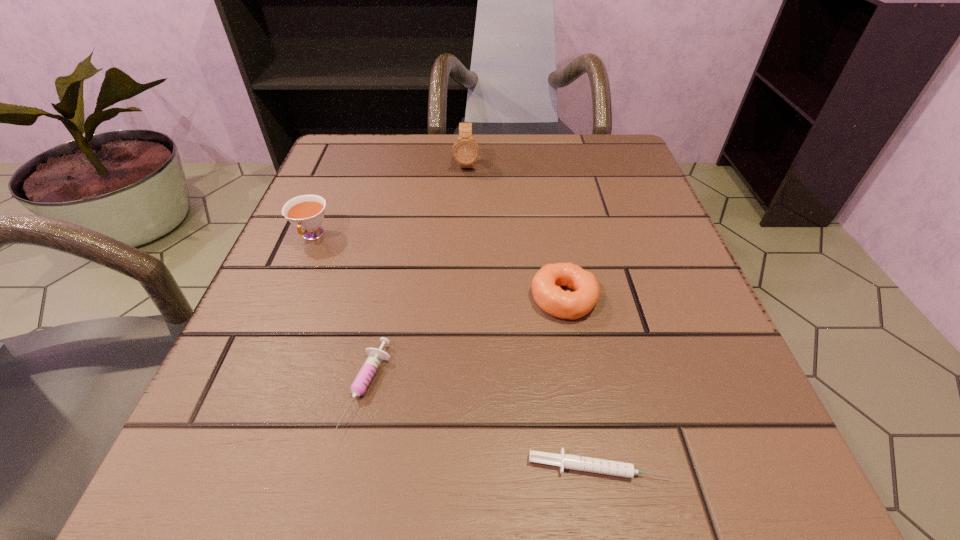
Identify the location of free space in the image that satisfies the following two spatial constraints: 1. on the side of the leftmost object with the handle; 2. on the left side of the second nearest object. (250, 387).

The height and width of the screenshot is (540, 960). In order to click on free location that satisfies the following two spatial constraints: 1. on the face of the third tallest object; 2. on the right side of the watch in this screenshot , I will do `click(461, 299)`.

Locate an element on the screen. This screenshot has height=540, width=960. vacant point that satisfies the following two spatial constraints: 1. on the side of the leftmost object with the handle; 2. on the left side of the shortest object is located at coordinates (216, 466).

Find the location of `free location that satisfies the following two spatial constraints: 1. on the face of the tallest object; 2. on the right side of the third shortest object`. free location that satisfies the following two spatial constraints: 1. on the face of the tallest object; 2. on the right side of the third shortest object is located at coordinates (461, 299).

Locate an element on the screen. blank space that satisfies the following two spatial constraints: 1. on the side of the third shortest object with the handle; 2. on the left side of the second farthest object is located at coordinates (286, 299).

What are the coordinates of `free location that satisfies the following two spatial constraints: 1. on the face of the right syringe; 2. on the left side of the watch` in the screenshot? It's located at (454, 466).

Image resolution: width=960 pixels, height=540 pixels. I want to click on vacant space that satisfies the following two spatial constraints: 1. on the face of the right syringe; 2. on the right side of the watch, so click(x=454, y=466).